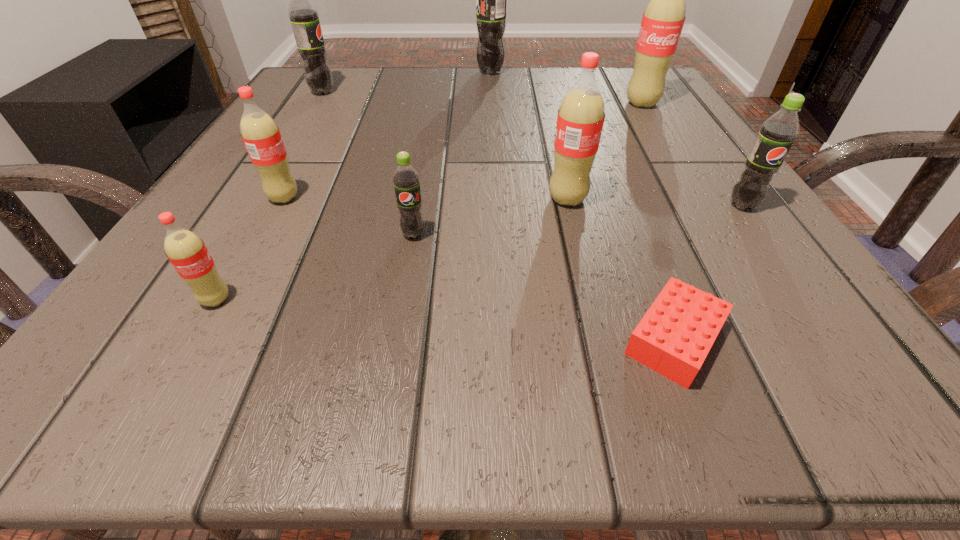
Where is `object positioned at the far right corner`? object positioned at the far right corner is located at coordinates (663, 19).

Find the location of a particular element. This screenshot has height=540, width=960. object that is at the near right corner is located at coordinates (675, 335).

Locate an element on the screen. vacant space at the far edge of the desktop is located at coordinates (561, 75).

At what (x,y) coordinates should I click in order to perform the action: click on free space at the near edge. Please return your answer as a coordinate pair (x, y). Looking at the image, I should click on (411, 403).

The image size is (960, 540). What are the coordinates of `vacant space at the left edge of the desktop` in the screenshot? It's located at (239, 298).

You are a GUI agent. You are given a task and a screenshot of the screen. Output one action in this format:
    pyautogui.click(x=<x>, y=<y>)
    Task: Click on the free space at the right edge of the desktop
    The height and width of the screenshot is (540, 960).
    Given the screenshot: What is the action you would take?
    pyautogui.click(x=757, y=254)

Identify the location of vacant region at the far left corner of the desktop. (333, 68).

You are a GUI agent. You are given a task and a screenshot of the screen. Output one action in this format:
    pyautogui.click(x=<x>, y=<y>)
    Task: Click on the vacant space at the near right corner of the desktop
    The height and width of the screenshot is (540, 960).
    Given the screenshot: What is the action you would take?
    pyautogui.click(x=794, y=387)

This screenshot has width=960, height=540. What are the coordinates of `free spot between the second farthest green soda and the sixth soda from left to right` in the screenshot? It's located at (444, 146).

I want to click on empty location between the third biggest red soda and the second red soda from right to left, so click(425, 199).